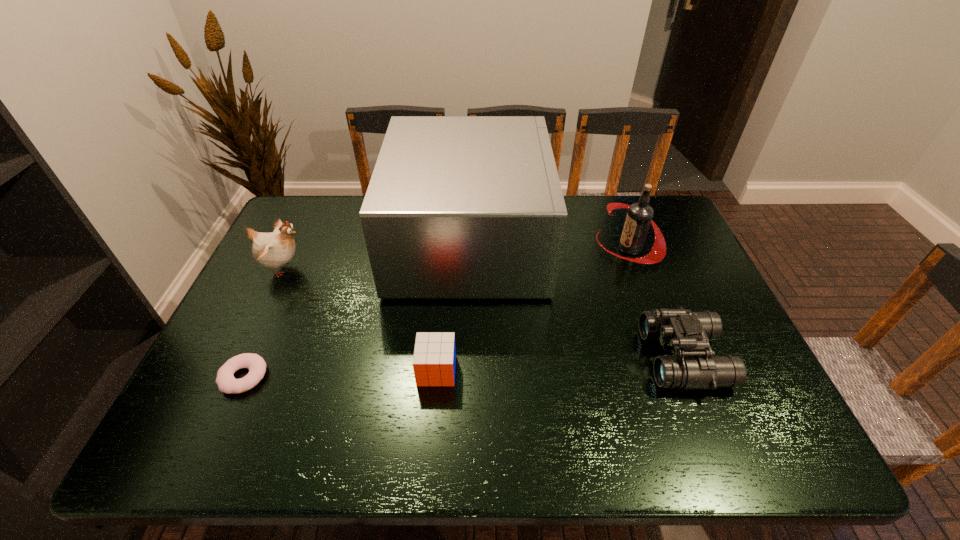
Where is `the tallest object`? The image size is (960, 540). the tallest object is located at coordinates (457, 206).

You are a GUI agent. You are given a task and a screenshot of the screen. Output one action in this format:
    pyautogui.click(x=<x>, y=<y>)
    Task: Click on the second tallest object
    The image size is (960, 540).
    Given the screenshot: What is the action you would take?
    pyautogui.click(x=639, y=217)

Identify the location of the third tallest object. 272,250.

Where is `the fourth tallest object`? the fourth tallest object is located at coordinates (694, 365).

This screenshot has width=960, height=540. I want to click on the second shortest object, so click(x=434, y=359).

You are a GUI agent. You are given a task and a screenshot of the screen. Output one action in this format:
    pyautogui.click(x=<x>, y=<y>)
    Task: Click on the doughnut
    This screenshot has height=540, width=960.
    Given the screenshot: What is the action you would take?
    pyautogui.click(x=226, y=382)

At what (x,y) coordinates should I click in order to perform the action: click on free space located with the door open on the microwave oven. Please return your answer as a coordinate pair (x, y). Image resolution: width=960 pixels, height=540 pixels. Looking at the image, I should click on (660, 242).

Locate an element on the screen. vacant space located 0.180m on the label of the root beer is located at coordinates (539, 248).

This screenshot has height=540, width=960. Find the location of `free space located on the label of the root beer`. free space located on the label of the root beer is located at coordinates (493, 248).

Where is `vacant region located 0.200m on the label of the root beer`? The height and width of the screenshot is (540, 960). vacant region located 0.200m on the label of the root beer is located at coordinates (532, 248).